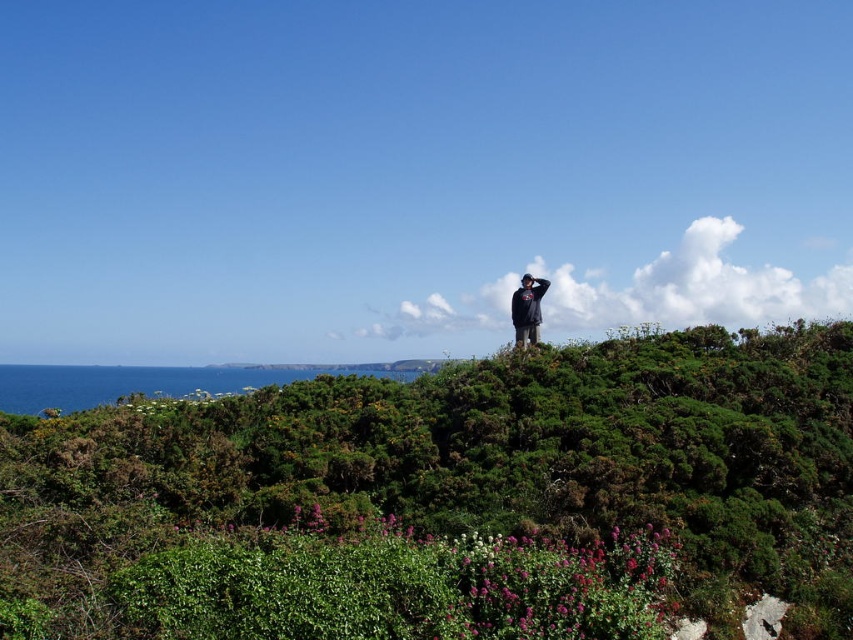
Does green leafy shrubs at center appear on the right side of dark blue sweatshirt at center?

Indeed, green leafy shrubs at center is positioned on the right side of dark blue sweatshirt at center.

Which is behind, point (235, 404) or point (527, 301)?

Positioned behind is point (527, 301).

Measure the distance between green leafy shrubs at center and camera.

green leafy shrubs at center is 23.61 feet away from camera.

Find the location of a particular element. green leafy shrubs at center is located at coordinates (450, 499).